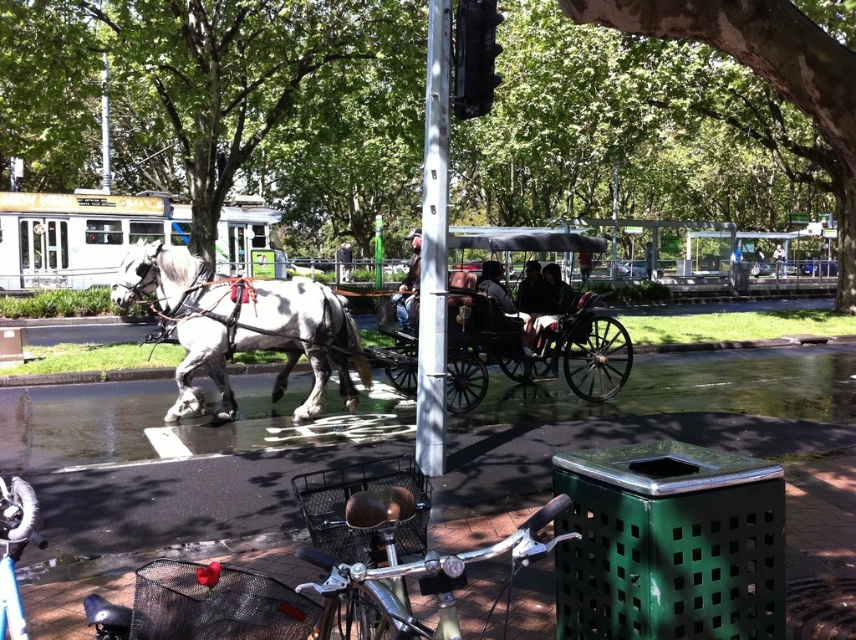
Looking at this image, you are a photographer standing at the edge of the street. You want to take a photo of both the gray glossy horse at center and the wooden polished cart at center. Given their sizes, which one should you focus on to ensure both are clearly visible in the frame?

Since the gray glossy horse at center is smaller than the wooden polished cart at center, you should focus on the wooden polished cart at center to ensure both are clearly visible in the frame.

You are standing at the edge of the park and see both the wooden polished cart at center and the wooden coach at center. Which one do you see first as you look towards the center of the park?

The wooden polished cart at center is closer to the viewer than the wooden coach at center, so you would see the wooden polished cart at center first when looking towards the center of the park.

You are a photographer standing at the side of the street. You want to take a photo that includes both the gray glossy horse at center and the wooden coach at center. Which object should you focus on first if you want to ensure both are in the frame?

The gray glossy horse at center has a lesser height compared to wooden coach at center, so you should focus on the wooden coach at center first to ensure both are in the frame.